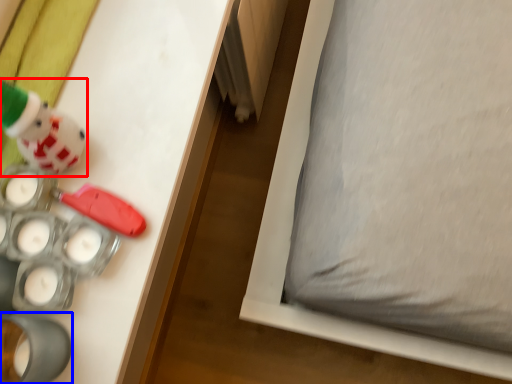
Question: Which object is closer to the camera taking this photo, toy (highlighted by a red box) or toy (highlighted by a blue box)?

Choices:
 (A) toy
 (B) toy

Answer: (A)